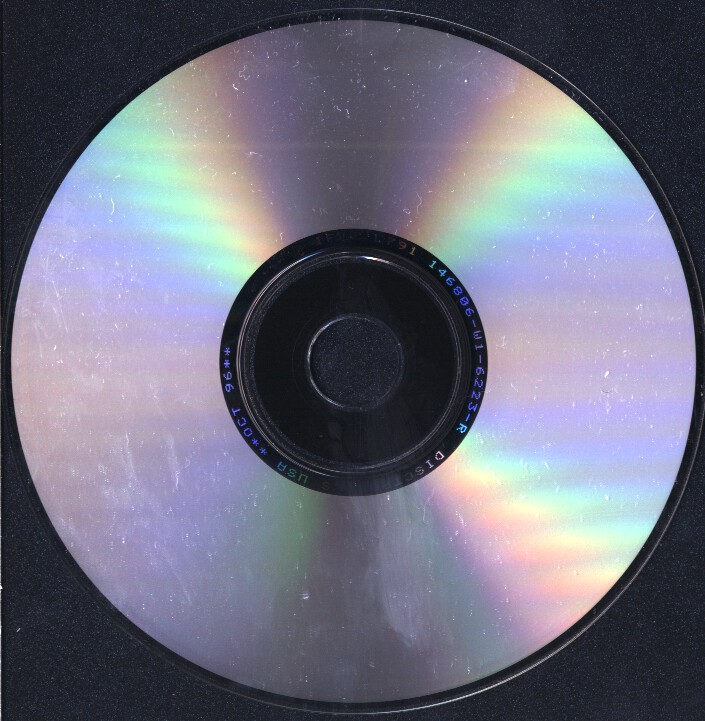
The width and height of the screenshot is (705, 721). Find the location of `cd`. cd is located at coordinates tap(111, 399), tap(166, 533), tap(591, 442), tap(474, 190), tap(324, 99), tap(282, 117), tap(190, 205), tap(608, 283), tap(469, 531).